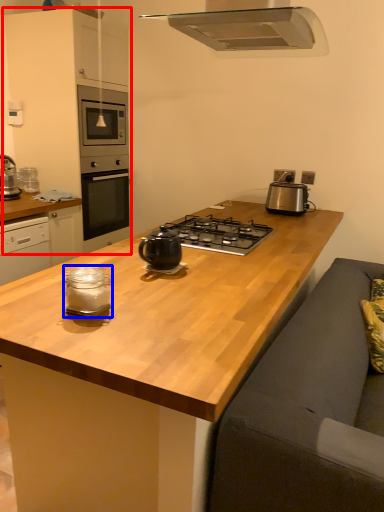
Question: Among these objects, which one is nearest to the camera, cabinetry (highlighted by a red box) or kitchen appliance (highlighted by a blue box)?

Choices:
 (A) cabinetry
 (B) kitchen appliance

Answer: (B)